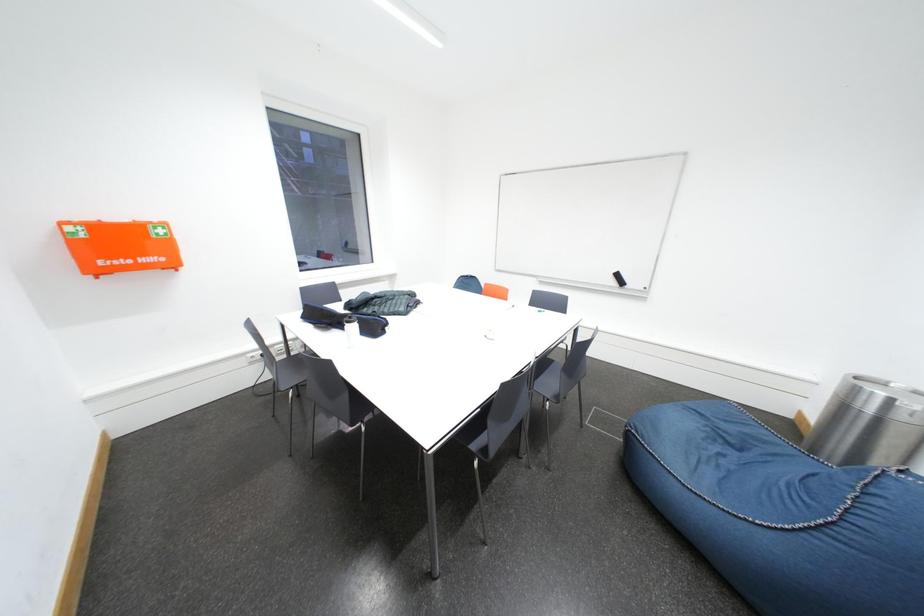
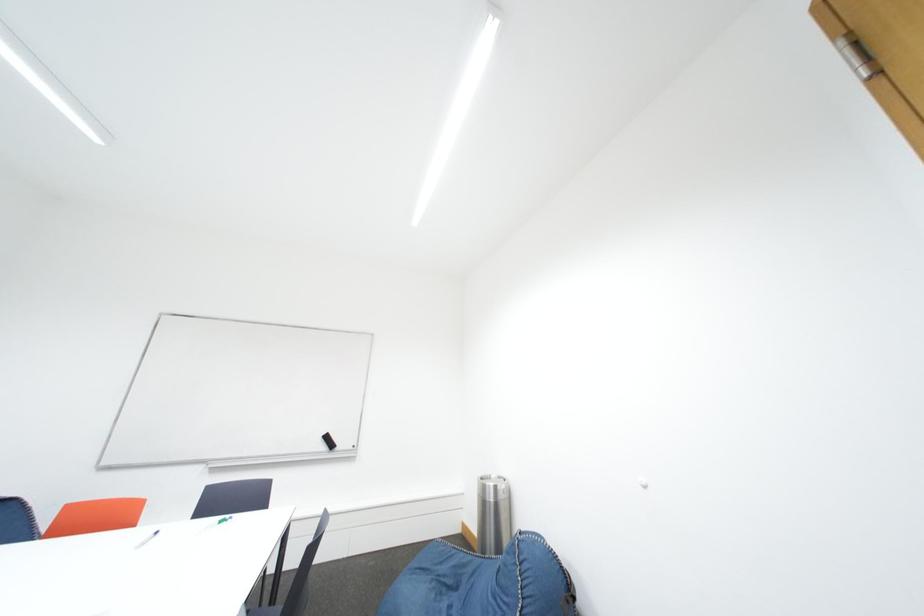
How did the camera likely rotate?

The rotation direction of the camera is right-up.